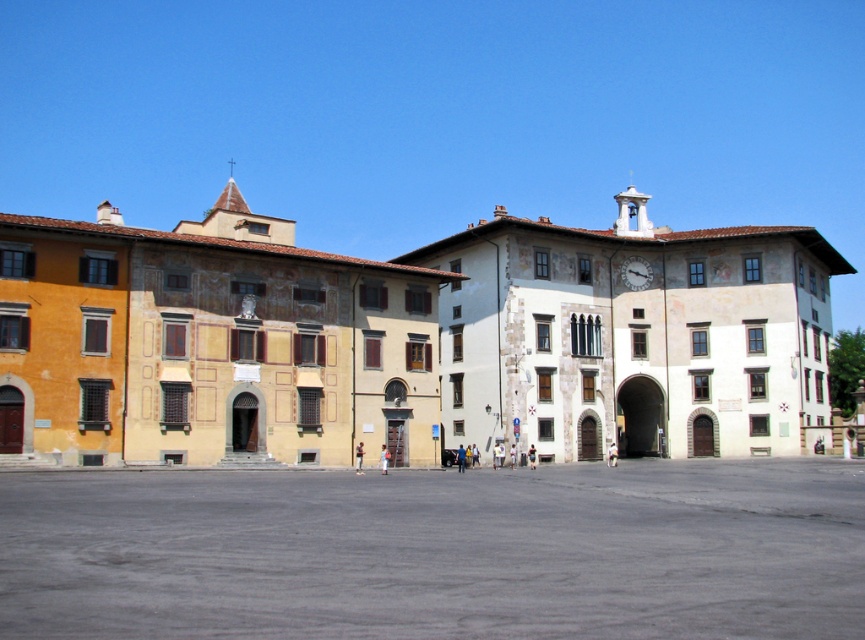
Does yellow painted building at center lie behind matte brown clock at center-right?

No, it is in front of matte brown clock at center-right.

Is yellow painted building at center above matte brown clock at center-right?

Yes, yellow painted building at center is above matte brown clock at center-right.

Identify the location of yellow painted building at center. (413, 340).